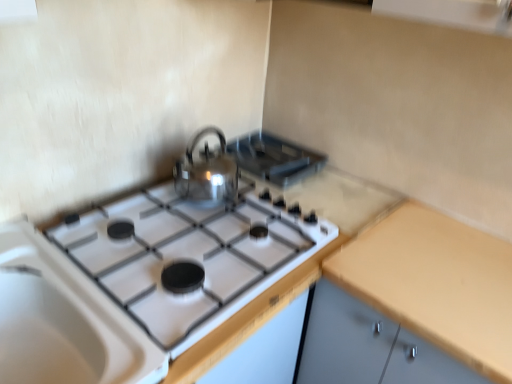
You are a GUI agent. You are given a task and a screenshot of the screen. Output one action in this format:
    pyautogui.click(x=<x>, y=<y>)
    Task: Click on the vacant space underneath shiny metallic kettle at center (from a real-world perspective)
    The height and width of the screenshot is (384, 512).
    Given the screenshot: What is the action you would take?
    pyautogui.click(x=199, y=198)